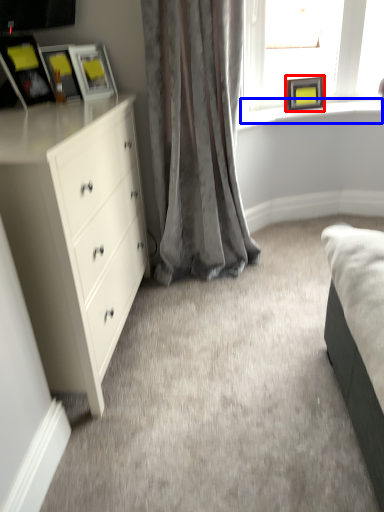
Question: Which object appears farthest to the camera in this image, picture frame (highlighted by a red box) or window sill (highlighted by a blue box)?

Choices:
 (A) picture frame
 (B) window sill

Answer: (B)